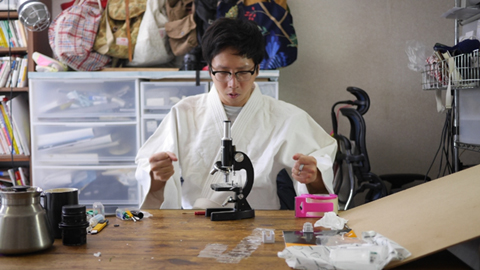
This screenshot has width=480, height=270. I want to click on wood board, so click(x=444, y=228).